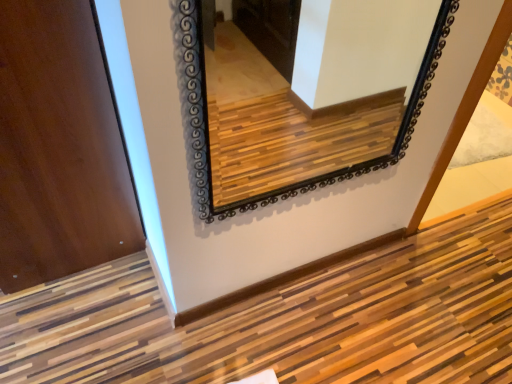
The width and height of the screenshot is (512, 384). I want to click on free area below black glass mirror at upper center (from a real-world perspective), so click(295, 273).